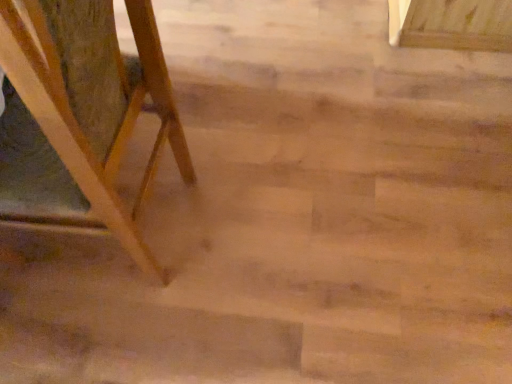
The width and height of the screenshot is (512, 384). In order to click on unoccupied region to the right of wooden easel at left in this screenshot , I will do `click(262, 219)`.